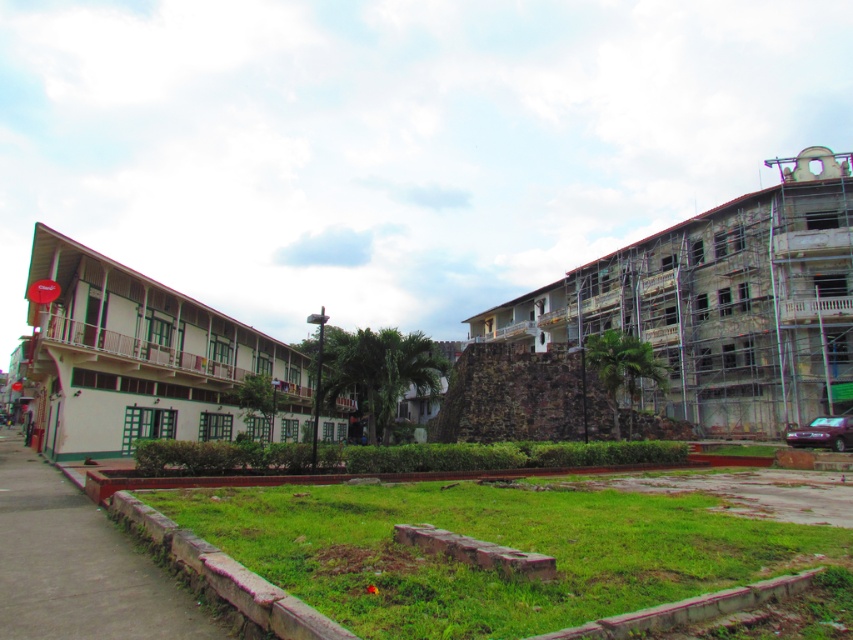
You are a delivery drone with a maximum flight range of 40 meters. You need to deliver a package from the concrete sidewalk at lower left to the stone textured wall at right. Can you complete this delivery without needing to recharge?

The distance between the stone textured wall at right and the concrete sidewalk at lower left is 36.83 meters, which is within your 40 meter range. Yes, you can complete the delivery without recharging.

You are a drone operator trying to land a drone on a flat surface. You see the point at coordinates (721, 304) and the stone textured wall at right. Which object is suitable for landing?

The point at coordinates (721, 304) is suitable for landing because it is a flat surface, whereas the stone textured wall at right is a vertical structure and not suitable for landing.